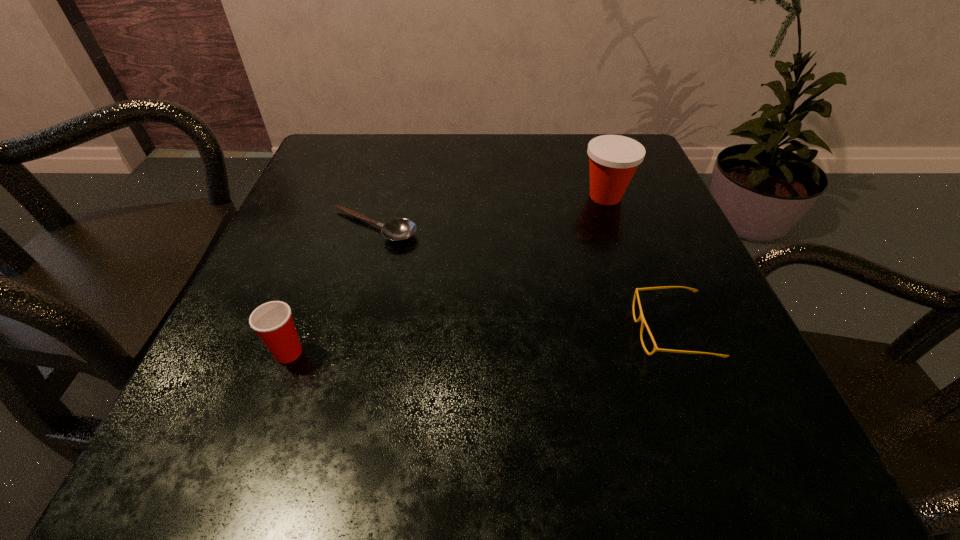
Where is `blank region between the shorter Dixie cup and the ladle`? The image size is (960, 540). blank region between the shorter Dixie cup and the ladle is located at coordinates (331, 290).

Find the location of a particular element. The height and width of the screenshot is (540, 960). vacant area between the shortest object and the second shortest object is located at coordinates (522, 280).

Identify the location of free space between the spectacles and the nearer Dixie cup. (480, 342).

Choose which object is the nearest neighbor to the right Dixie cup. Please provide its 2D coordinates. Your answer should be formatted as a tuple, i.e. [(x, y)], where the tuple contains the x and y coordinates of a point satisfying the conditions above.

[(641, 318)]

Choose which object is the second nearest neighbor to the taller Dixie cup. Please provide its 2D coordinates. Your answer should be formatted as a tuple, i.e. [(x, y)], where the tuple contains the x and y coordinates of a point satisfying the conditions above.

[(400, 229)]

Where is `free point that satisfies the following two spatial constraints: 1. on the back side of the shortest object; 2. on the right side of the nearer Dixie cup`? Image resolution: width=960 pixels, height=540 pixels. free point that satisfies the following two spatial constraints: 1. on the back side of the shortest object; 2. on the right side of the nearer Dixie cup is located at coordinates (335, 227).

Where is `blank space that satisfies the following two spatial constraints: 1. on the back side of the taller Dixie cup; 2. on the left side of the ladle`? Image resolution: width=960 pixels, height=540 pixels. blank space that satisfies the following two spatial constraints: 1. on the back side of the taller Dixie cup; 2. on the left side of the ladle is located at coordinates (382, 196).